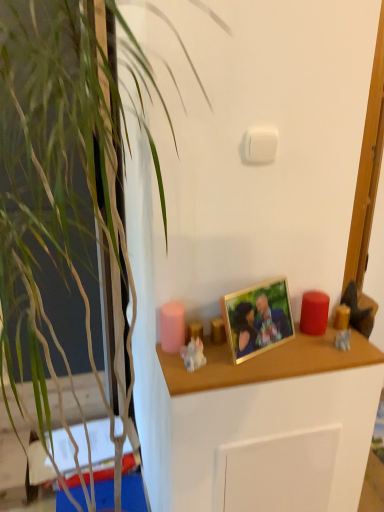
Question: From a real-world perspective, is wooden shelf at center physically located above or below translucent amber glass candle at right, which is the third candle from left to right?

Choices:
 (A) below
 (B) above

Answer: (A)

Question: Considering the positions of wooden shelf at center and translucent amber glass candle at right, which is the third candle from left to right, in the image, is wooden shelf at center bigger or smaller than translucent amber glass candle at right, which is the third candle from left to right,?

Choices:
 (A) big
 (B) small

Answer: (A)

Question: Estimate the real-world distances between objects in this image. Which object is closer to the white plastic light switch at upper center?

Choices:
 (A) translucent plastic figurine at right, the second toy in the front-to-back sequence
 (B) gold metallic picture frame at center
 (C) pink matte candle at center, acting as the 3th candle starting from the right
 (D) wooden shelf at center
 (E) porcelain figurine at center, which is the second toy from right to left

Answer: (B)

Question: Which of these objects is positioned farthest from the wooden cabinet at center?

Choices:
 (A) red matte candle at right, the 2th candle positioned from the right
 (B) white plastic light switch at upper center
 (C) gold metallic picture frame at center
 (D) pink matte candle at center, acting as the 3th candle starting from the right
 (E) wooden shelf at center

Answer: (B)